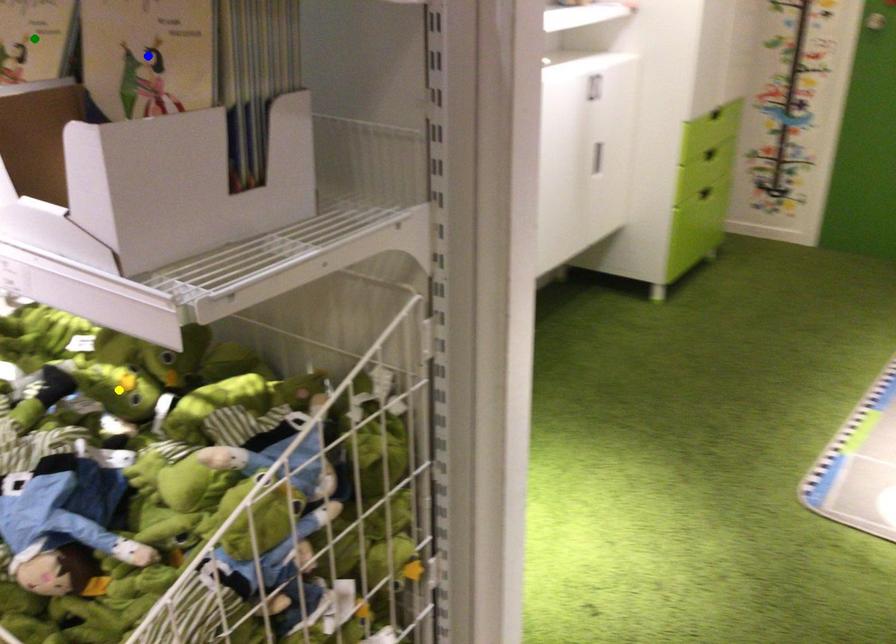
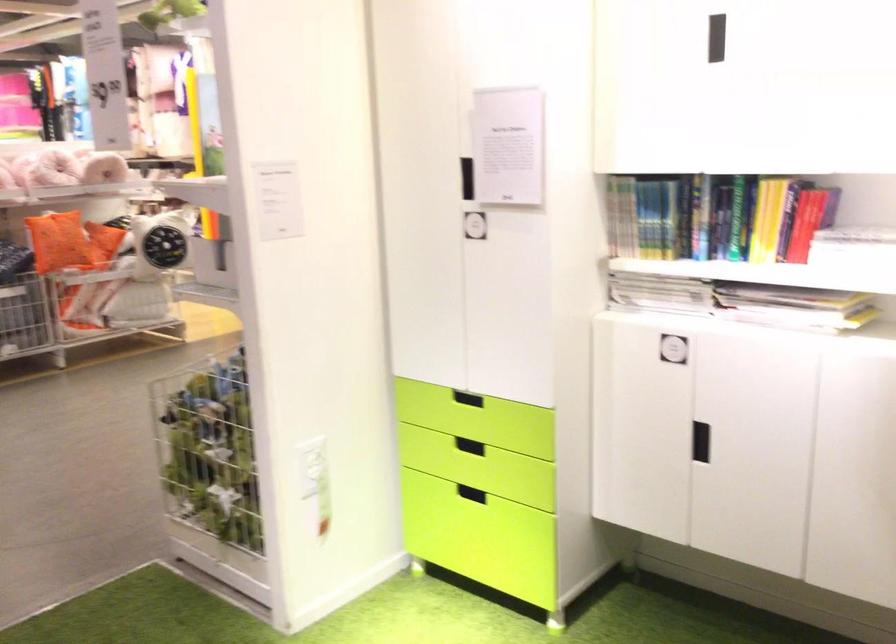
I am providing you with two images of the same scene from different viewpoints. Three points are marked in image1. Which point corresponds to a part or object that is occluded in image2?In image1, three points are marked. Which of them correspond to a part or object that is occluded in image2?Among the three points shown in image1, which one corresponds to a part or object that is no longer visible due to occlusion in image2?

yellow point, blue point, green point